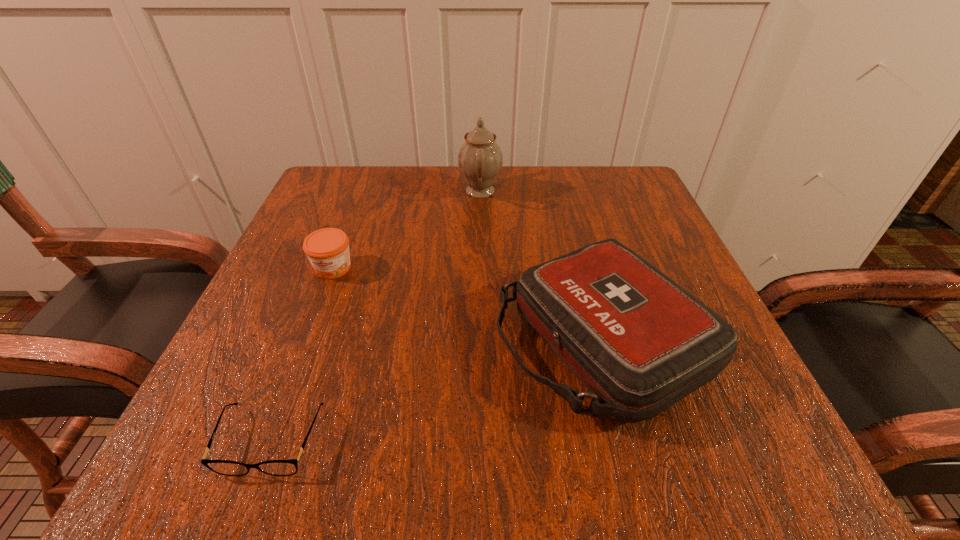
Locate an element on the screen. free location that satisfies the following two spatial constraints: 1. on the front label of the second tallest object; 2. on the right side of the jam is located at coordinates (305, 341).

This screenshot has width=960, height=540. What are the coordinates of `vacant area in the image that satisfies the following two spatial constraints: 1. on the spout of the chinaware; 2. on the front-facing side of the shortest object` in the screenshot? It's located at [x=480, y=441].

Where is `vacant area that satisfies the following two spatial constraints: 1. on the front label of the jam; 2. on the right side of the third shortest object`? This screenshot has height=540, width=960. vacant area that satisfies the following two spatial constraints: 1. on the front label of the jam; 2. on the right side of the third shortest object is located at coordinates (305, 341).